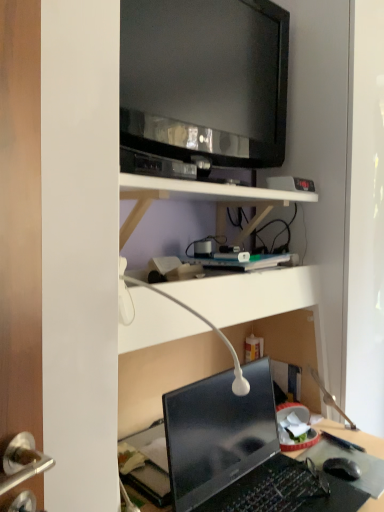
Question: From the image's perspective, is white glossy table lamp at center over glossy black laptop at lower center?

Choices:
 (A) yes
 (B) no

Answer: (A)

Question: Is white glossy table lamp at center smaller than glossy black laptop at lower center?

Choices:
 (A) yes
 (B) no

Answer: (A)

Question: Is white glossy table lamp at center oriented towards glossy black laptop at lower center?

Choices:
 (A) yes
 (B) no

Answer: (B)

Question: Is white glossy table lamp at center behind glossy black laptop at lower center?

Choices:
 (A) no
 (B) yes

Answer: (A)

Question: Is white glossy table lamp at center outside of glossy black laptop at lower center?

Choices:
 (A) no
 (B) yes

Answer: (B)

Question: Considering the relative positions of white matte shelf at upper center and white glossy table lamp at center in the image provided, is white matte shelf at upper center to the left or to the right of white glossy table lamp at center?

Choices:
 (A) left
 (B) right

Answer: (B)

Question: From the image's perspective, is white matte shelf at upper center located above or below white glossy table lamp at center?

Choices:
 (A) below
 (B) above

Answer: (B)

Question: In terms of size, does white matte shelf at upper center appear bigger or smaller than white glossy table lamp at center?

Choices:
 (A) big
 (B) small

Answer: (A)

Question: Considering the positions of point (223, 226) and point (152, 288), is point (223, 226) closer or farther from the camera than point (152, 288)?

Choices:
 (A) farther
 (B) closer

Answer: (A)

Question: Is black glossy television at upper center wider or thinner than white matte shelf at upper center?

Choices:
 (A) thin
 (B) wide

Answer: (A)

Question: Based on their sizes in the image, would you say black glossy television at upper center is bigger or smaller than white matte shelf at upper center?

Choices:
 (A) small
 (B) big

Answer: (A)

Question: Would you say black glossy television at upper center is inside or outside white matte shelf at upper center?

Choices:
 (A) outside
 (B) inside

Answer: (A)

Question: Is black glossy television at upper center in front of or behind white matte shelf at upper center in the image?

Choices:
 (A) front
 (B) behind

Answer: (B)

Question: Based on their sizes in the image, would you say black matte computer mouse at lower right is bigger or smaller than black glossy television at upper center?

Choices:
 (A) big
 (B) small

Answer: (B)

Question: Considering the positions of point (359, 477) and point (231, 115), is point (359, 477) closer or farther from the camera than point (231, 115)?

Choices:
 (A) closer
 (B) farther

Answer: (A)